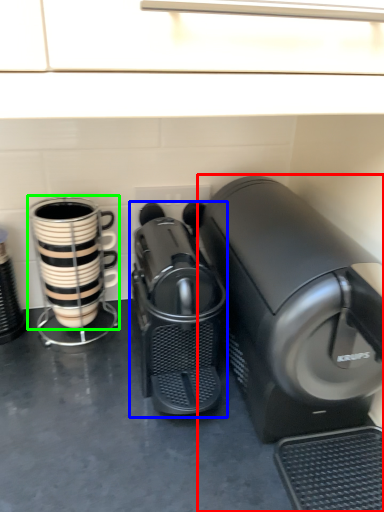
Question: Estimate the real-world distances between objects in this image. Which object is farther from home appliance (highlighted by a red box), home appliance (highlighted by a blue box) or coffee cup (highlighted by a green box)?

Choices:
 (A) home appliance
 (B) coffee cup

Answer: (B)